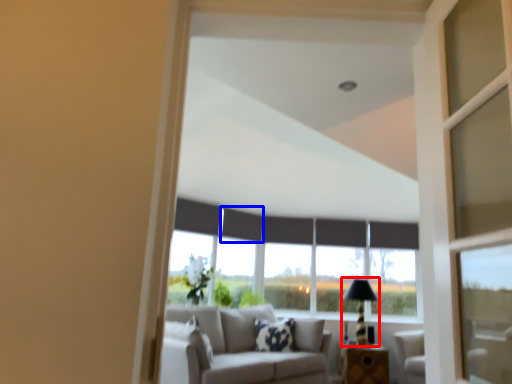
Question: Which of the following is the farthest to the observer, table lamp (highlighted by a red box) or curtain (highlighted by a blue box)?

Choices:
 (A) table lamp
 (B) curtain

Answer: (B)